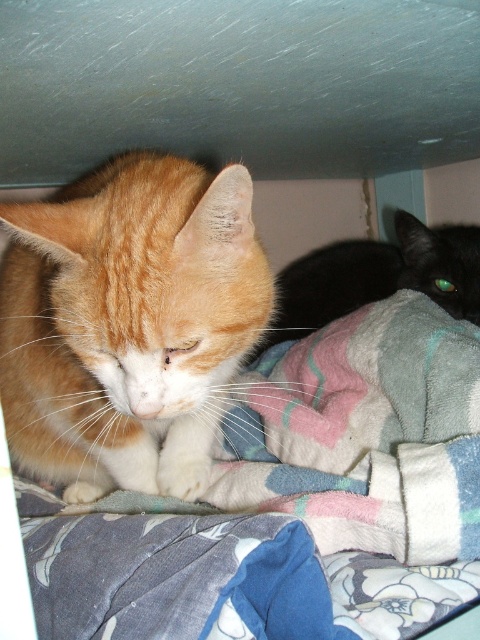
You are a cat owner who wants to place a small toy between the fluffy multicolored blanket at center and the orange fur cat at center. The toy is 3 inches long. Will there be enough space between them to fit the toy?

The fluffy multicolored blanket at center and orange fur cat at center are 7.42 inches apart. Since the toy is only 3 inches long, there is sufficient space between them to place the toy.

From the picture: You are a cat owner trying to place a small toy between the orange fur cat at center and the black glossy cat at lower right. The toy requires at least 20 inches of space to be placed safely. Can you fit the toy between them?

The orange fur cat at center is 20.12 inches away from the black glossy cat at lower right. Since the required space is 20 inches, the toy can be placed safely between them as the distance is sufficient.

Based on the photo, you are a cat owner trying to locate your fluffy multicolored blanket at center. Where is it positioned in the image?

The fluffy multicolored blanket at center is located at point (294, 500).